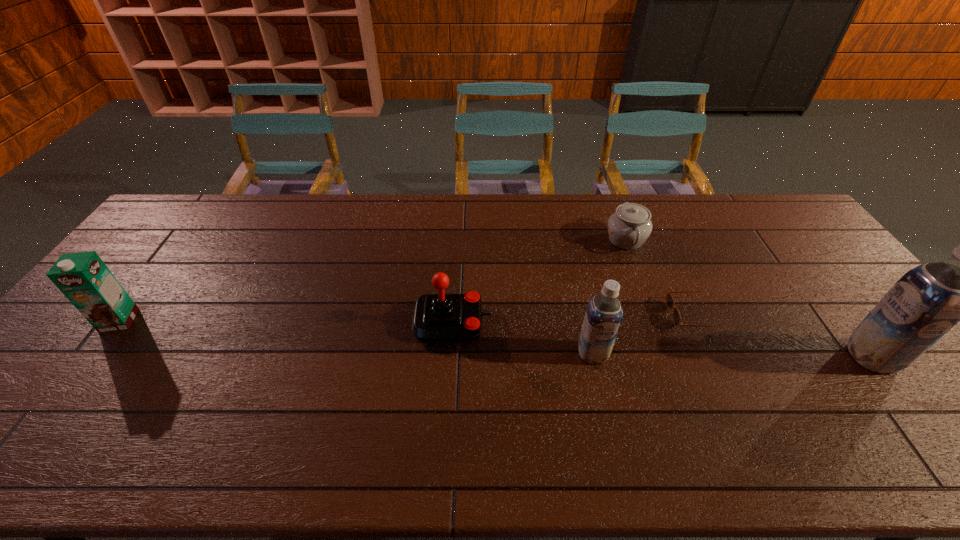
Identify the location of object that is positioned at the far edge. (629, 227).

This screenshot has height=540, width=960. What are the coordinates of `object situated at the left edge` in the screenshot? It's located at (x=83, y=277).

The width and height of the screenshot is (960, 540). I want to click on object that is at the right edge, so [x=923, y=305].

In the image, there is a desktop. At what (x,y) coordinates should I click in order to perform the action: click on free space at the far edge. Please return your answer as a coordinate pair (x, y). The width and height of the screenshot is (960, 540). Looking at the image, I should click on (324, 205).

I want to click on free space at the near edge of the desktop, so click(x=647, y=414).

I want to click on blank space at the right edge of the desktop, so [828, 272].

At what (x,y) coordinates should I click in order to perform the action: click on free space at the far right corner. Please return your answer as a coordinate pair (x, y). Looking at the image, I should click on (773, 202).

You are a GUI agent. You are given a task and a screenshot of the screen. Output one action in this format:
    pyautogui.click(x=<x>, y=<y>)
    Task: Click on the vacant space that's between the left soya milk and the fourth tallest object
    
    Given the screenshot: What is the action you would take?
    pyautogui.click(x=522, y=338)

Identify the location of vacant point located between the leftmost object and the fifth object from right to left. (286, 321).

Locate an element on the screen. This screenshot has height=540, width=960. empty space between the sunglasses and the third object from left to right is located at coordinates (643, 334).